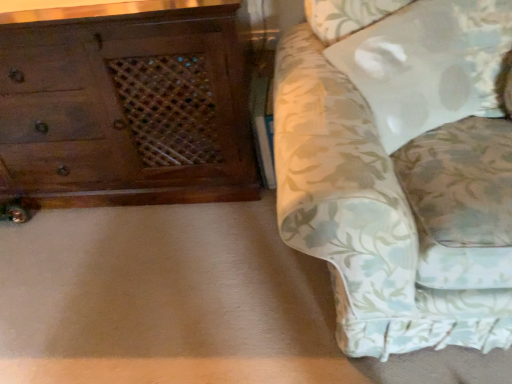
Question: Considering the relative positions of wooden chest of drawers at left and floral fabric couch at right in the image provided, is wooden chest of drawers at left in front of floral fabric couch at right?

Choices:
 (A) no
 (B) yes

Answer: (A)

Question: Does wooden chest of drawers at left appear on the left side of floral fabric couch at right?

Choices:
 (A) yes
 (B) no

Answer: (A)

Question: Does wooden chest of drawers at left come behind floral fabric couch at right?

Choices:
 (A) no
 (B) yes

Answer: (B)

Question: From the image's perspective, would you say wooden chest of drawers at left is shown under floral fabric couch at right?

Choices:
 (A) yes
 (B) no

Answer: (B)

Question: From a real-world perspective, is wooden chest of drawers at left below floral fabric couch at right?

Choices:
 (A) no
 (B) yes

Answer: (B)

Question: Visually, is floral fabric couch at right positioned to the left or to the right of wooden chest of drawers at left?

Choices:
 (A) left
 (B) right

Answer: (B)

Question: From the image's perspective, relative to wooden chest of drawers at left, is floral fabric couch at right above or below?

Choices:
 (A) below
 (B) above

Answer: (A)

Question: In terms of size, does floral fabric couch at right appear bigger or smaller than wooden chest of drawers at left?

Choices:
 (A) big
 (B) small

Answer: (A)

Question: From a real-world perspective, is floral fabric couch at right above or below wooden chest of drawers at left?

Choices:
 (A) below
 (B) above

Answer: (B)

Question: Considering the positions of wooden chest of drawers at left and floral fabric couch at right in the image, is wooden chest of drawers at left taller or shorter than floral fabric couch at right?

Choices:
 (A) short
 (B) tall

Answer: (A)

Question: From the image's perspective, is wooden chest of drawers at left positioned above or below floral fabric couch at right?

Choices:
 (A) above
 (B) below

Answer: (A)

Question: Is wooden chest of drawers at left spatially inside floral fabric couch at right, or outside of it?

Choices:
 (A) outside
 (B) inside

Answer: (A)

Question: Is point (120, 109) positioned closer to the camera than point (305, 198)?

Choices:
 (A) closer
 (B) farther

Answer: (B)

Question: Is white fabric pillow at upper right situated inside floral fabric couch at right or outside?

Choices:
 (A) outside
 (B) inside

Answer: (B)

Question: From a real-world perspective, relative to floral fabric couch at right, is white fabric pillow at upper right vertically above or below?

Choices:
 (A) below
 (B) above

Answer: (B)